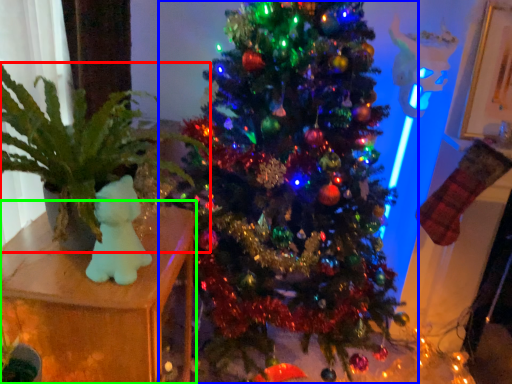
Question: Which object is the closest to the houseplant (highlighted by a red box)? Choose among these: christmas tree (highlighted by a blue box) or furniture (highlighted by a green box).

Choices:
 (A) christmas tree
 (B) furniture

Answer: (B)